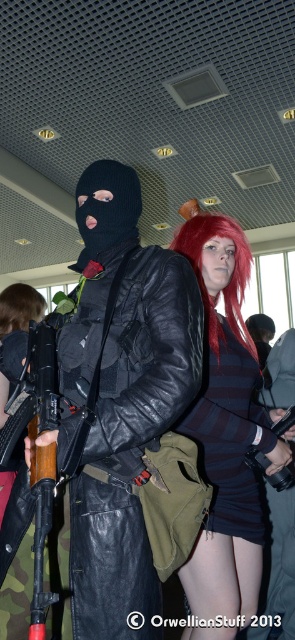
You are a photographer trying to capture a closeup of the striped fabric skirt at center and the matte black gun at center. Since your camera can only focus on one object at a time, which object should you aim the camera at first to ensure the other is still in frame?

The striped fabric skirt at center is positioned on the left side of matte black gun at center. Therefore, you should aim the camera at the striped fabric skirt at center first to ensure the matte black gun at center remains in frame to the right.

You are standing in a public indoor space and see the matte black leather jacket at center. If you want to reach into your pocket to grab your phone, will you have to move away from the jacket?

The matte black leather jacket at center is 32.47 inches away from you, so you can safely reach into your pocket without needing to move away from the jacket.